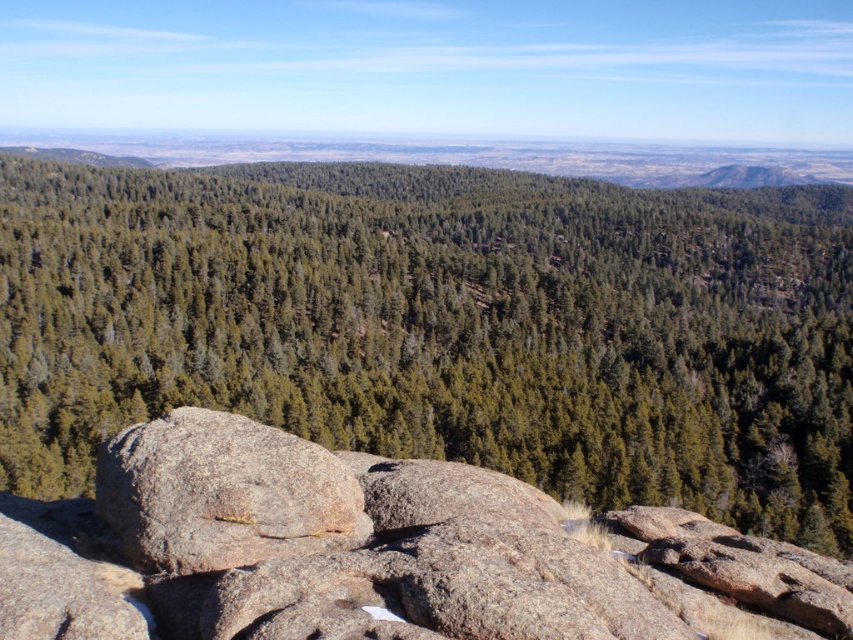
Does gray granite rock at center have a smaller size compared to gray rough boulder at center?

No, gray granite rock at center is not smaller than gray rough boulder at center.

Consider the image. Is gray granite rock at center thinner than gray rough boulder at center?

Incorrect, gray granite rock at center's width is not less than gray rough boulder at center's.

The image size is (853, 640). Identify the location of gray granite rock at center. (376, 552).

Can you confirm if green matte forest at center is positioned to the left of gray granite rock at center?

In fact, green matte forest at center is to the right of gray granite rock at center.

Is green matte forest at center shorter than gray granite rock at center?

No.

Which is behind, point (22, 304) or point (122, 556)?

Point (22, 304)

Locate an element on the screen. Image resolution: width=853 pixels, height=640 pixels. green matte forest at center is located at coordinates (444, 326).

Is green matte forest at center in front of gray rough boulder at center?

No, green matte forest at center is behind gray rough boulder at center.

The width and height of the screenshot is (853, 640). What are the coordinates of `green matte forest at center` in the screenshot? It's located at (444, 326).

I want to click on green matte forest at center, so click(444, 326).